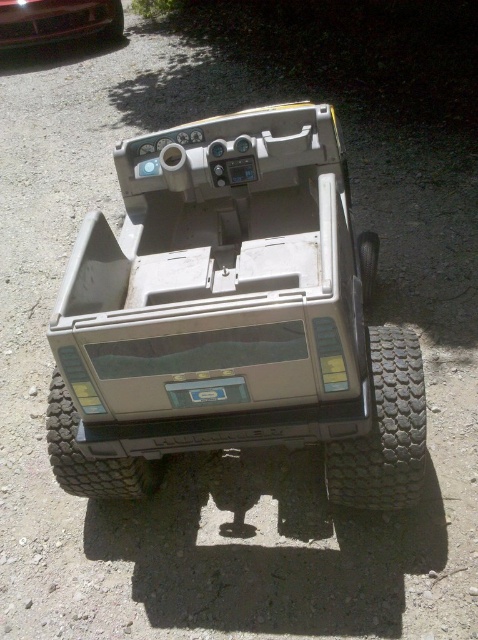
Question: Can you confirm if black rubber tire at lower right is positioned below dark gray rugged tire at bottom center?

Choices:
 (A) no
 (B) yes

Answer: (A)

Question: Is black rubber tire at lower right closer to camera compared to black rubber wheel at lower left?

Choices:
 (A) yes
 (B) no

Answer: (A)

Question: Which point is farther from the camera taking this photo?

Choices:
 (A) pyautogui.click(x=88, y=465)
 (B) pyautogui.click(x=366, y=300)
 (C) pyautogui.click(x=389, y=456)
 (D) pyautogui.click(x=119, y=35)

Answer: (D)

Question: Which of the following is the closest to the observer?

Choices:
 (A) click(x=361, y=284)
 (B) click(x=107, y=493)
 (C) click(x=85, y=0)

Answer: (B)

Question: Can you confirm if matte gray jeep at center is wider than shiny black car at upper left?

Choices:
 (A) no
 (B) yes

Answer: (A)

Question: Estimate the real-world distances between objects in this image. Which object is farther from the shiny black car at upper left?

Choices:
 (A) dark gray rugged tire at bottom center
 (B) matte gray jeep at center

Answer: (A)